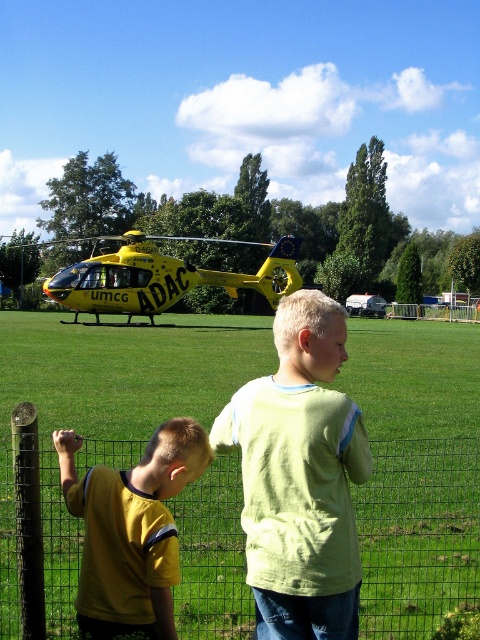
Question: Which object appears closest to the camera in this image?

Choices:
 (A) wire mesh fence at lower center
 (B) light green cotton shirt at center

Answer: (B)

Question: Is wire mesh fence at lower center closer to the viewer compared to yellow matte shirt at lower left?

Choices:
 (A) no
 (B) yes

Answer: (A)

Question: Which object appears farthest from the camera in this image?

Choices:
 (A) light green cotton shirt at center
 (B) wire mesh fence at lower center

Answer: (B)

Question: Is light green cotton shirt at center to the right of yellow matte helicopter at upper center from the viewer's perspective?

Choices:
 (A) yes
 (B) no

Answer: (A)

Question: Is light green cotton shirt at center further to camera compared to yellow matte shirt at lower left?

Choices:
 (A) yes
 (B) no

Answer: (B)

Question: Considering the real-world distances, which object is closest to the light green cotton shirt at center?

Choices:
 (A) wire mesh fence at lower center
 (B) yellow matte shirt at lower left
 (C) yellow matte helicopter at upper center

Answer: (B)